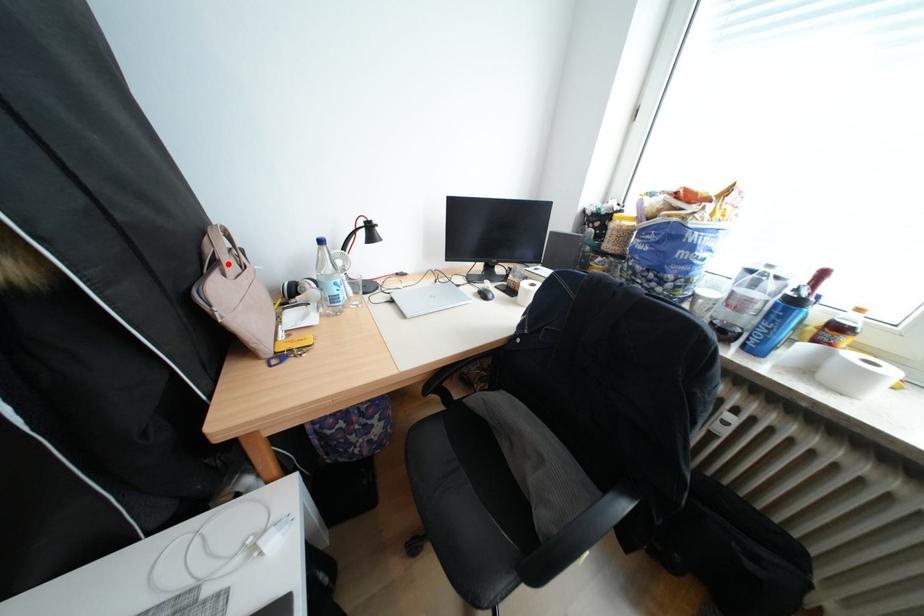
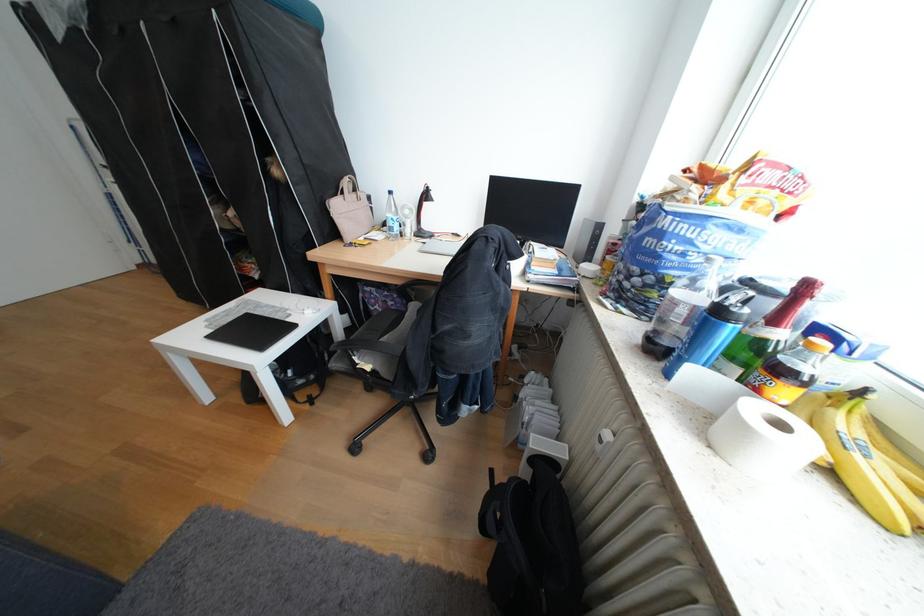
Question: A red point is marked in image1. In image2, is the corresponding 3D point closer to the camera or farther? Reply with the corresponding letter.

Choices:
 (A) The corresponding 3D point is closer.
 (B) The corresponding 3D point is farther.

Answer: (A)